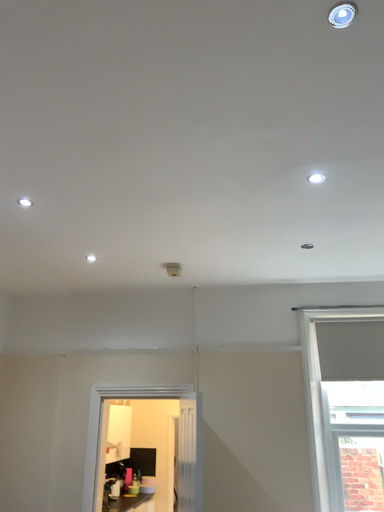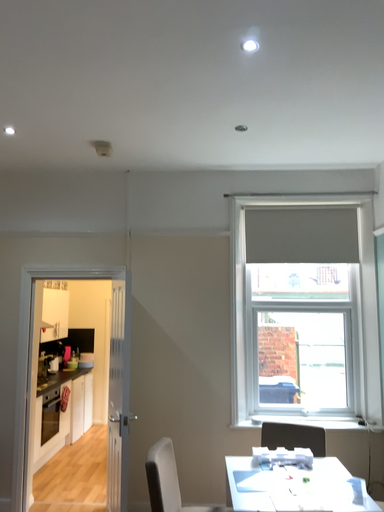
Question: Which way did the camera rotate in the video?

Choices:
 (A) rotated right
 (B) rotated left

Answer: (A)